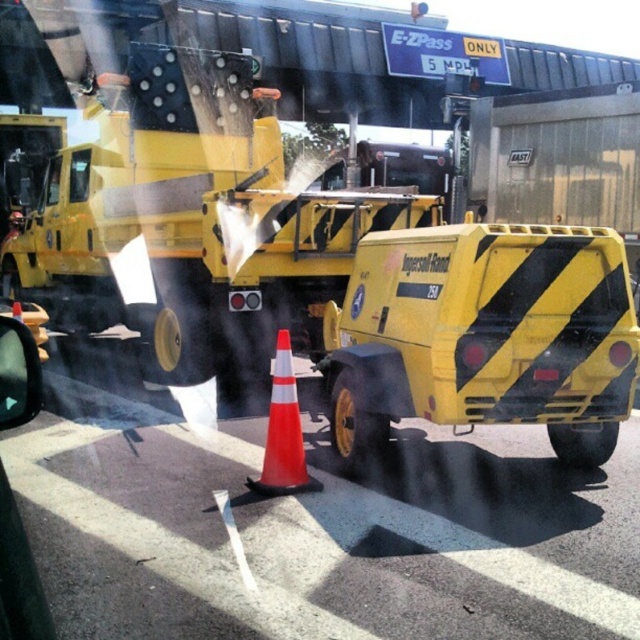
Does yellow matte asphalt roller at center appear on the left side of orange reflective cone at center?

Incorrect, yellow matte asphalt roller at center is not on the left side of orange reflective cone at center.

Does yellow matte asphalt roller at center appear over orange reflective cone at center?

Yes.

You are a GUI agent. You are given a task and a screenshot of the screen. Output one action in this format:
    pyautogui.click(x=<x>, y=<y>)
    Task: Click on the yellow matte asphalt roller at center
    
    Given the screenshot: What is the action you would take?
    pyautogui.click(x=483, y=337)

At what (x,y) coordinates should I click in order to perform the action: click on yellow matte asphalt roller at center. Please return your answer as a coordinate pair (x, y). Looking at the image, I should click on (483, 337).